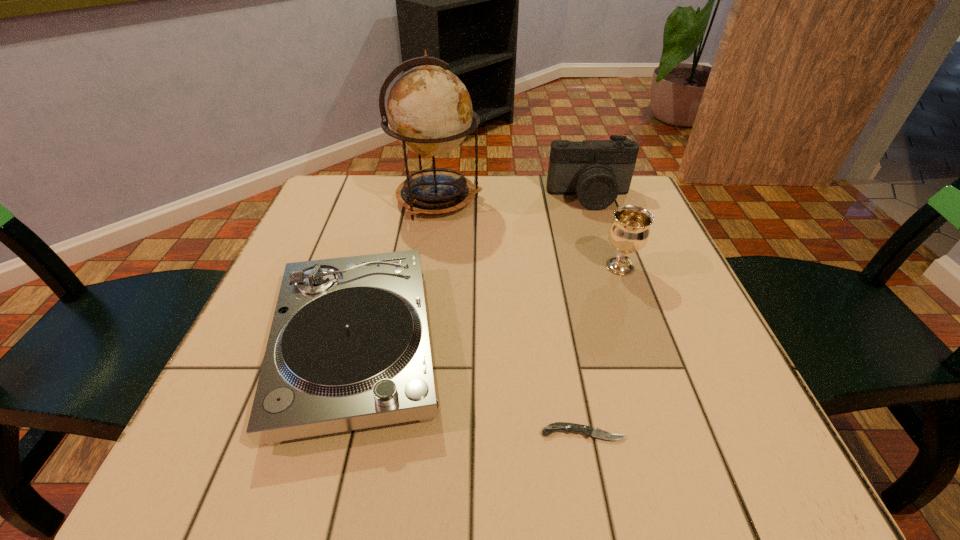
The image size is (960, 540). In order to click on globe that is at the far edge in this screenshot , I will do `click(429, 110)`.

You are a GUI agent. You are given a task and a screenshot of the screen. Output one action in this format:
    pyautogui.click(x=<x>, y=<y>)
    Task: Click on the camera located in the far edge section of the desktop
    Image resolution: width=960 pixels, height=540 pixels.
    Given the screenshot: What is the action you would take?
    pyautogui.click(x=597, y=171)

Where is `record player that is at the near edge`? The image size is (960, 540). record player that is at the near edge is located at coordinates (x=349, y=348).

Where is `pocketknife situated at the near edge`? pocketknife situated at the near edge is located at coordinates (587, 431).

Locate an element on the screen. object at the left edge is located at coordinates (349, 348).

This screenshot has width=960, height=540. I want to click on camera that is at the right edge, so click(597, 171).

Locate an element on the screen. The width and height of the screenshot is (960, 540). chalice that is at the right edge is located at coordinates (629, 232).

The height and width of the screenshot is (540, 960). In order to click on object situated at the near left corner in this screenshot , I will do `click(349, 348)`.

You are a GUI agent. You are given a task and a screenshot of the screen. Output one action in this format:
    pyautogui.click(x=<x>, y=<y>)
    Task: Click on the object that is at the far right corner
    This screenshot has height=540, width=960.
    Given the screenshot: What is the action you would take?
    pyautogui.click(x=597, y=171)

Find the location of a particular element. This screenshot has height=540, width=960. vacant area at the far edge of the desktop is located at coordinates (582, 225).